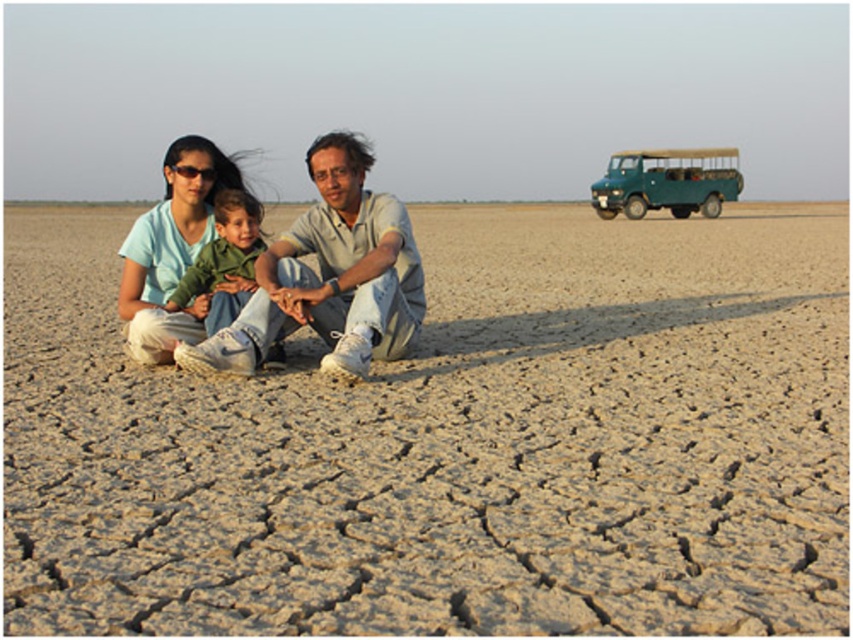
Question: Where is light beige cotton shirt at center located in relation to matte blue shirt at upper left in the image?

Choices:
 (A) above
 (B) below

Answer: (B)

Question: Is matte blue shirt at upper left further to the viewer compared to green cotton shirt at center?

Choices:
 (A) no
 (B) yes

Answer: (A)

Question: Estimate the real-world distances between objects in this image. Which object is closer to the light beige cotton shirt at center?

Choices:
 (A) dried mud at center
 (B) matte blue shirt at upper left
 (C) green matte jeep at upper right

Answer: (B)

Question: Based on their relative distances, which object is nearer to the green cotton shirt at center?

Choices:
 (A) green matte jeep at upper right
 (B) matte blue shirt at upper left
 (C) light beige cotton shirt at center
 (D) dried mud at center

Answer: (B)

Question: Which point appears farthest from the camera in this image?

Choices:
 (A) (326, 134)
 (B) (602, 445)
 (C) (229, 234)

Answer: (C)

Question: Is dried mud at center wider than green matte jeep at upper right?

Choices:
 (A) no
 (B) yes

Answer: (B)